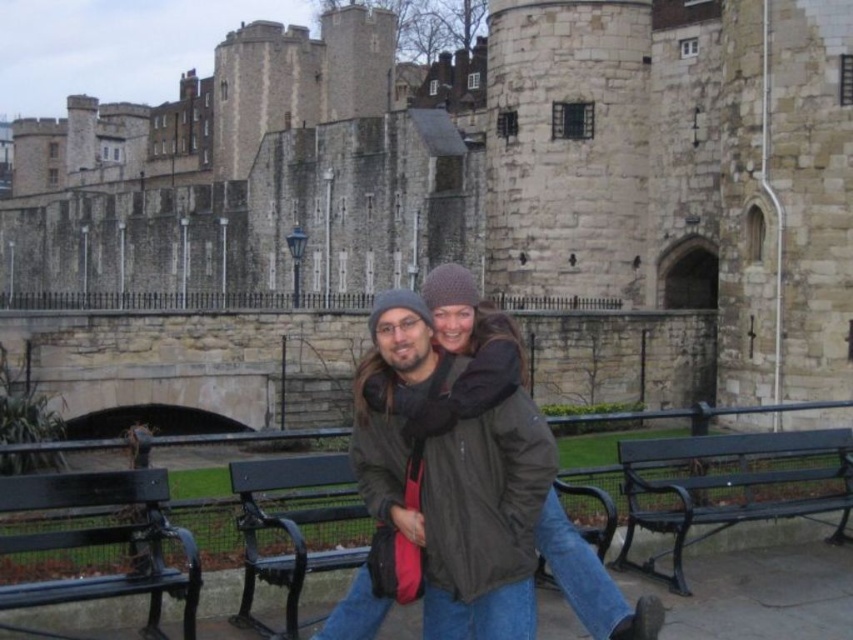
Question: Can you confirm if green painted wood bench at center is bigger than green painted wood park bench at lower left?

Choices:
 (A) yes
 (B) no

Answer: (A)

Question: Which point is closer to the camera?

Choices:
 (A) green painted wood bench at center
 (B) green painted metal bench at lower right
 (C) dark brown leather jacket at center
 (D) green painted wood park bench at lower left

Answer: (C)

Question: Does green painted metal bench at lower right appear on the left side of dark brown leather jacket at center?

Choices:
 (A) yes
 (B) no

Answer: (B)

Question: Which of the following is the farthest from the observer?

Choices:
 (A) green painted metal bench at lower right
 (B) dark brown leather jacket at center
 (C) green painted wood bench at center
 (D) black metal bench at center

Answer: (A)

Question: Based on their relative distances, which object is nearer to the dark brown leather jacket at center?

Choices:
 (A) black metal bench at center
 (B) green painted metal bench at lower right
 (C) green painted wood bench at center

Answer: (C)

Question: Is green painted metal bench at lower right to the left of dark brown leather jacket at center from the viewer's perspective?

Choices:
 (A) no
 (B) yes

Answer: (A)